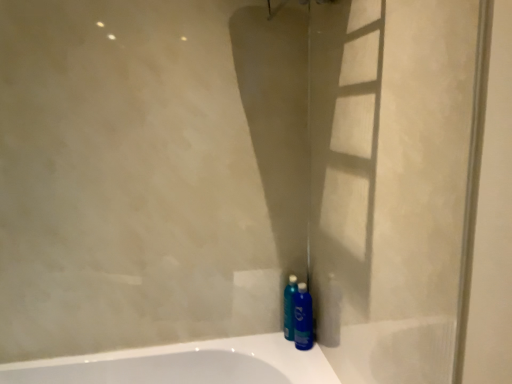
Question: Is point (294, 291) closer or farther from the camera than point (306, 306)?

Choices:
 (A) farther
 (B) closer

Answer: (A)

Question: Relative to blue glossy bottle at lower right, is metallic blue spray bottle at lower right in front or behind?

Choices:
 (A) front
 (B) behind

Answer: (B)

Question: In terms of size, does metallic blue spray bottle at lower right appear bigger or smaller than blue glossy bottle at lower right?

Choices:
 (A) small
 (B) big

Answer: (A)

Question: Is blue glossy bottle at lower right wider or thinner than metallic blue spray bottle at lower right?

Choices:
 (A) thin
 (B) wide

Answer: (B)

Question: Considering the positions of point (300, 326) and point (285, 334), is point (300, 326) closer or farther from the camera than point (285, 334)?

Choices:
 (A) closer
 (B) farther

Answer: (A)

Question: Relative to metallic blue spray bottle at lower right, is blue glossy bottle at lower right in front or behind?

Choices:
 (A) behind
 (B) front

Answer: (B)

Question: Is blue glossy bottle at lower right inside the boundaries of metallic blue spray bottle at lower right, or outside?

Choices:
 (A) inside
 (B) outside

Answer: (B)